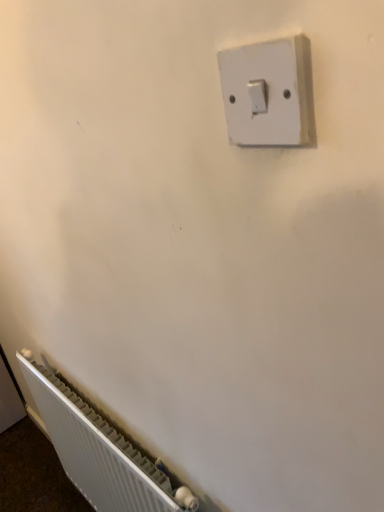
Question: Can you confirm if white ribbed radiator at lower left is bigger than white plastic light switch at upper center?

Choices:
 (A) no
 (B) yes

Answer: (B)

Question: Does white ribbed radiator at lower left appear on the left side of white plastic light switch at upper center?

Choices:
 (A) no
 (B) yes

Answer: (B)

Question: Does white ribbed radiator at lower left have a lesser height compared to white plastic light switch at upper center?

Choices:
 (A) yes
 (B) no

Answer: (B)

Question: Considering the relative sizes of white ribbed radiator at lower left and white plastic light switch at upper center in the image provided, is white ribbed radiator at lower left smaller than white plastic light switch at upper center?

Choices:
 (A) no
 (B) yes

Answer: (A)

Question: Is white ribbed radiator at lower left not within white plastic light switch at upper center?

Choices:
 (A) no
 (B) yes

Answer: (B)

Question: Can white plastic light switch at upper center be found inside white ribbed radiator at lower left?

Choices:
 (A) no
 (B) yes

Answer: (A)

Question: Is white plastic light switch at upper center further to the viewer compared to white ribbed radiator at lower left?

Choices:
 (A) no
 (B) yes

Answer: (A)

Question: Considering the relative sizes of white plastic light switch at upper center and white ribbed radiator at lower left in the image provided, is white plastic light switch at upper center smaller than white ribbed radiator at lower left?

Choices:
 (A) yes
 (B) no

Answer: (A)

Question: From a real-world perspective, is white plastic light switch at upper center below white ribbed radiator at lower left?

Choices:
 (A) yes
 (B) no

Answer: (B)

Question: Is white plastic light switch at upper center bigger than white ribbed radiator at lower left?

Choices:
 (A) yes
 (B) no

Answer: (B)

Question: From the image's perspective, would you say white plastic light switch at upper center is shown under white ribbed radiator at lower left?

Choices:
 (A) no
 (B) yes

Answer: (A)

Question: Would you say white plastic light switch at upper center is a long distance from white ribbed radiator at lower left?

Choices:
 (A) yes
 (B) no

Answer: (A)

Question: Considering the positions of white ribbed radiator at lower left and white plastic light switch at upper center in the image, is white ribbed radiator at lower left wider or thinner than white plastic light switch at upper center?

Choices:
 (A) wide
 (B) thin

Answer: (A)